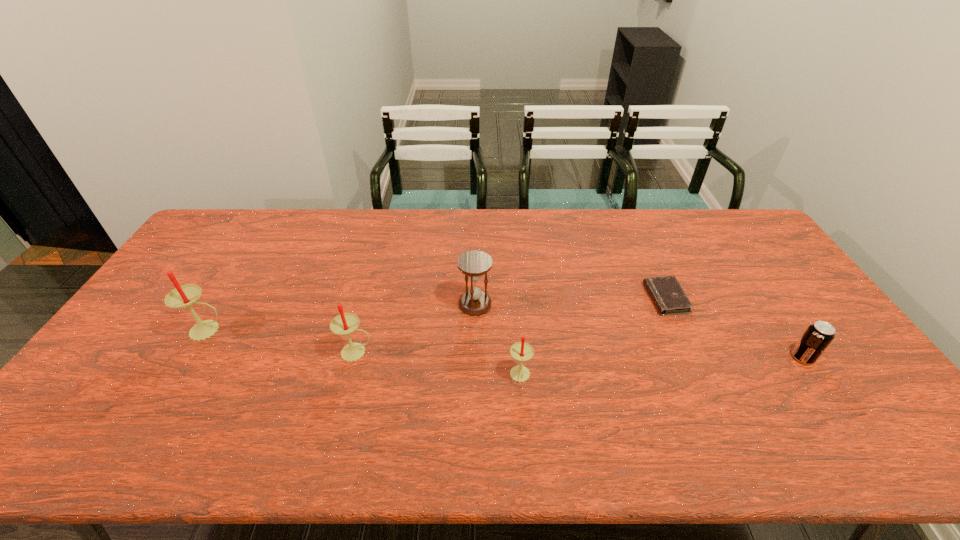
Where is `free area in between the diary and the fifth tallest object`? This screenshot has height=540, width=960. free area in between the diary and the fifth tallest object is located at coordinates 734,328.

I want to click on free area in between the rightmost object and the second candle from left to right, so click(x=580, y=355).

Find the location of a particular element. The image size is (960, 540). object that ranks as the closest to the fourth object from left to right is located at coordinates (473, 264).

Where is `object that stands as the second closest to the fifth object from right to left`? The height and width of the screenshot is (540, 960). object that stands as the second closest to the fifth object from right to left is located at coordinates (182, 296).

Select which candle is the second closest to the tallest candle. Please provide its 2D coordinates. Your answer should be formatted as a tuple, i.e. [(x, y)], where the tuple contains the x and y coordinates of a point satisfying the conditions above.

[(521, 351)]

The width and height of the screenshot is (960, 540). Identify the location of candle that stands as the closest to the rightmost candle. (345, 323).

Image resolution: width=960 pixels, height=540 pixels. I want to click on vacant space that satisfies the following two spatial constraints: 1. on the back side of the second shortest candle; 2. on the right side of the hourglass, so click(x=370, y=304).

Where is `free space that satisfies the following two spatial constraints: 1. on the back side of the second object from left to right; 2. on the right side of the hourglass`? The width and height of the screenshot is (960, 540). free space that satisfies the following two spatial constraints: 1. on the back side of the second object from left to right; 2. on the right side of the hourglass is located at coordinates click(370, 304).